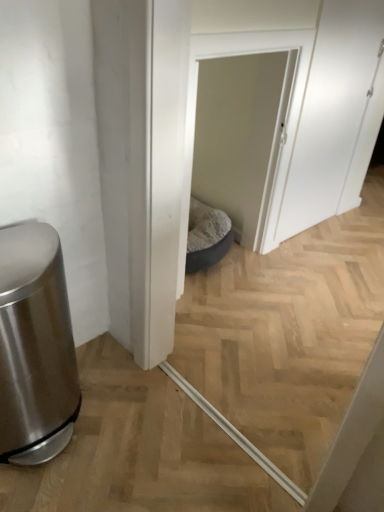
Identify the location of vacant area located to the right-hand side of white fabric pet bed at center, arranged as the 1th screen door when viewed from the left. The image size is (384, 512). (293, 282).